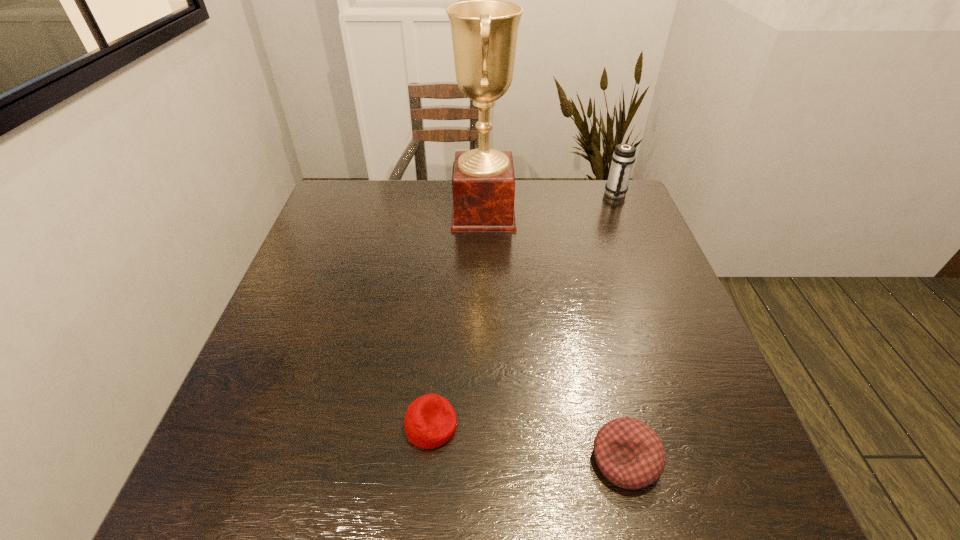
Find the location of `vacant region that satisfies the following two spatial constraints: 1. on the plaque of the trophy cup; 2. on the left side of the right beanbag`. vacant region that satisfies the following two spatial constraints: 1. on the plaque of the trophy cup; 2. on the left side of the right beanbag is located at coordinates (486, 460).

I want to click on vacant position in the image that satisfies the following two spatial constraints: 1. on the side with the handle of the thermos bottle; 2. on the seat area of the shortest object, so click(710, 426).